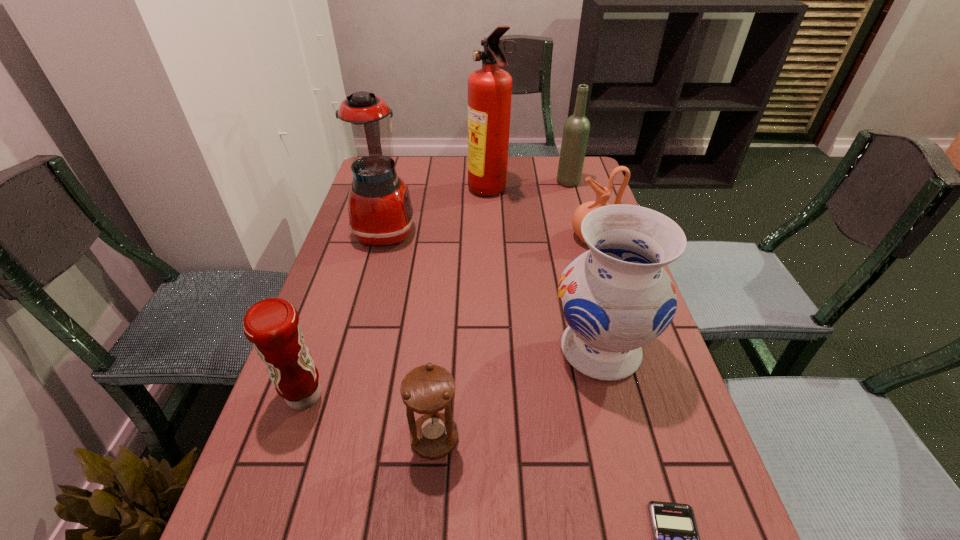
The width and height of the screenshot is (960, 540). In order to click on the tallest object in this screenshot , I will do `click(489, 88)`.

I want to click on the seventh shortest object, so click(x=380, y=211).

The width and height of the screenshot is (960, 540). Find the location of `wine bottle`. wine bottle is located at coordinates (576, 130).

Identify the location of vase. (616, 297).

The image size is (960, 540). Identify the location of condiment. (272, 325).

The width and height of the screenshot is (960, 540). I want to click on pottery, so click(x=603, y=194).

This screenshot has height=540, width=960. Find the location of `the seventh tallest object`. the seventh tallest object is located at coordinates (427, 389).

Where is `vacant region located on the front-facing side of the tallest object`? The width and height of the screenshot is (960, 540). vacant region located on the front-facing side of the tallest object is located at coordinates (418, 192).

In order to click on free region located on the front-facing side of the tallest object in this screenshot , I will do `click(447, 192)`.

Locate an element on the screen. This screenshot has width=960, height=540. vacant space located 0.120m on the front-facing side of the tallest object is located at coordinates (432, 192).